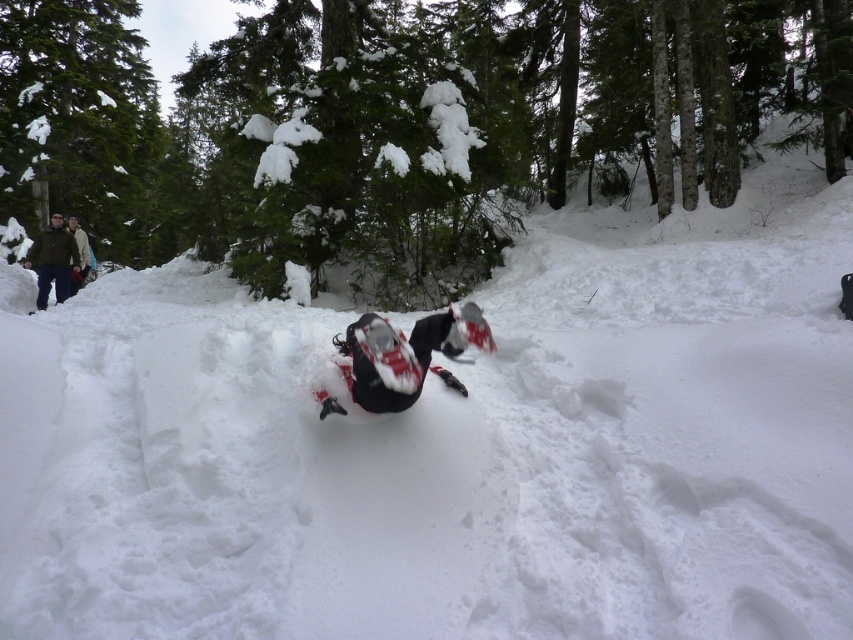
Question: Can you confirm if red matte snowmobile at center is positioned below green matte jacket at left?

Choices:
 (A) yes
 (B) no

Answer: (A)

Question: Which point is farther from the camera taking this photo?

Choices:
 (A) (80, 284)
 (B) (363, 400)
 (C) (32, 252)

Answer: (C)

Question: Which of the following is the farthest from the observer?

Choices:
 (A) green matte jacket at left
 (B) red matte snowmobile at center

Answer: (A)

Question: Which object is closer to the camera taking this photo?

Choices:
 (A) tan wool jacket at upper left
 (B) red matte snowmobile at center

Answer: (B)

Question: Can you confirm if red matte snowmobile at center is thinner than tan wool jacket at upper left?

Choices:
 (A) no
 (B) yes

Answer: (A)

Question: Does red matte snowmobile at center have a smaller size compared to tan wool jacket at upper left?

Choices:
 (A) yes
 (B) no

Answer: (B)